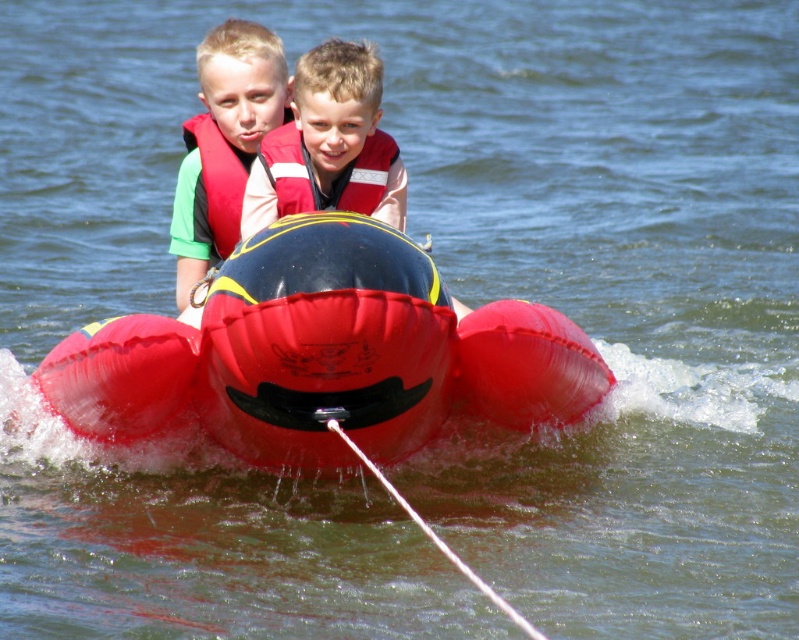
Is point (368, 192) closer to camera compared to point (237, 74)?

Yes, point (368, 192) is in front of point (237, 74).

In the scene shown: Does matte red life vest at center have a lesser width compared to matte red life vest at upper center?

Yes.

The height and width of the screenshot is (640, 799). What do you see at coordinates (328, 145) in the screenshot?
I see `matte red life vest at center` at bounding box center [328, 145].

The height and width of the screenshot is (640, 799). Find the location of `matte red life vest at center`. matte red life vest at center is located at coordinates (328, 145).

Can you confirm if rubberized red inflatable boat at center is positioned to the left of matte red life vest at center?

No, rubberized red inflatable boat at center is not to the left of matte red life vest at center.

How much distance is there between rubberized red inflatable boat at center and matte red life vest at center?

rubberized red inflatable boat at center is 2.24 meters away from matte red life vest at center.

Does point (146, 317) come farther from viewer compared to point (384, 157)?

No, it is in front of (384, 157).

The height and width of the screenshot is (640, 799). In order to click on rubberized red inflatable boat at center in this screenshot , I will do coord(322,355).

Is matte red life vest at center taller than red matte life jacket at center?

No.

Can you confirm if matte red life vest at center is positioned above red matte life jacket at center?

No, matte red life vest at center is not above red matte life jacket at center.

Measure the distance between matte red life vest at center and camera.

They are 13.31 meters apart.

Find the location of `matte red life vest at center`. matte red life vest at center is located at coordinates (328, 145).